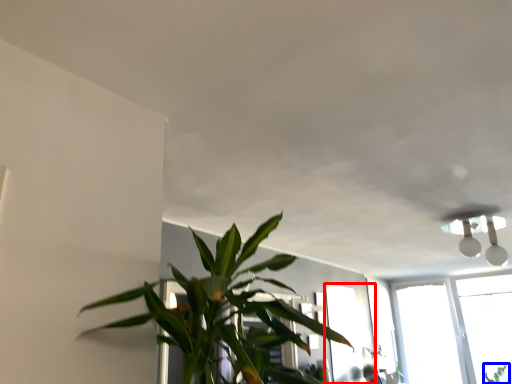
Question: Which object is closer to the camera taking this photo, window (highlighted by a red box) or plant (highlighted by a blue box)?

Choices:
 (A) window
 (B) plant

Answer: (A)